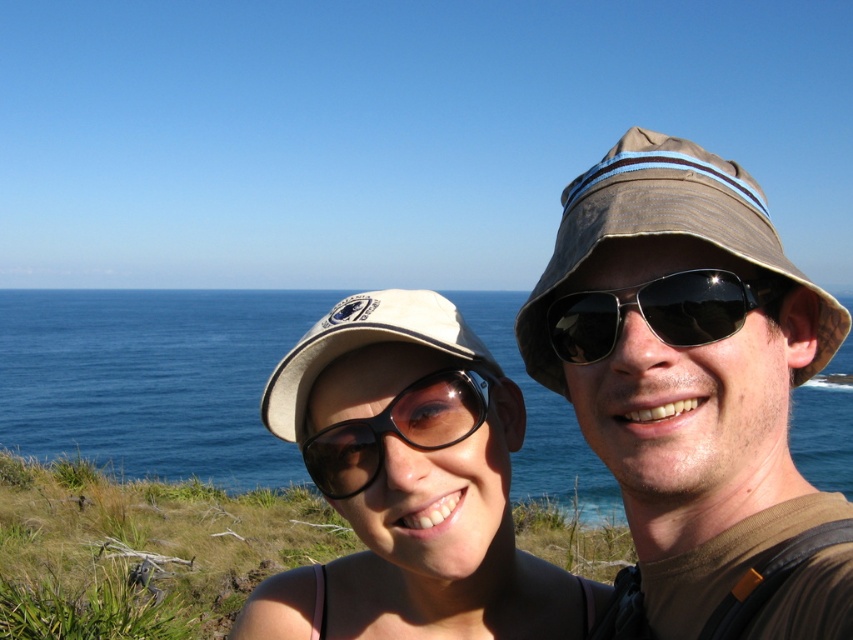
Question: From the image, what is the correct spatial relationship of blue water at center in relation to black matte sunglasses at center?

Choices:
 (A) right
 (B) left

Answer: (B)

Question: Which object is positioned closest to the blue water at center?

Choices:
 (A) matte brown hat at upper right
 (B) black reflective sunglasses at center
 (C) white fabric baseball cap at upper center

Answer: (B)

Question: From the image, what is the correct spatial relationship of matte brown hat at upper right in relation to blue water at center?

Choices:
 (A) above
 (B) below

Answer: (B)

Question: Considering the real-world distances, which object is closest to the white fabric baseball cap at upper center?

Choices:
 (A) black matte sunglasses at center
 (B) blue water at center
 (C) black reflective sunglasses at center

Answer: (A)

Question: Is matte brown hat at upper right positioned at the back of black reflective sunglasses at center?

Choices:
 (A) yes
 (B) no

Answer: (B)

Question: Estimate the real-world distances between objects in this image. Which object is farther from the blue water at center?

Choices:
 (A) black matte sunglasses at center
 (B) matte brown hat at upper right
 (C) black reflective sunglasses at center

Answer: (B)